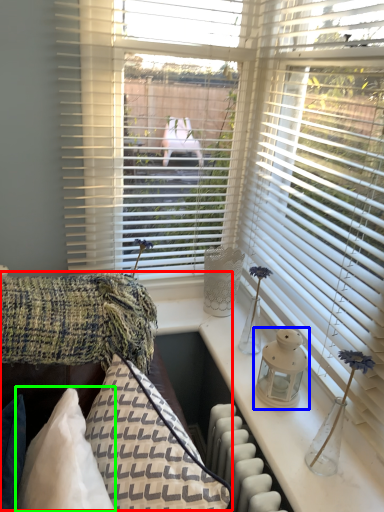
Question: Considering the real-world distances, which object is farthest from couch (highlighted by a red box)? candle holder (highlighted by a blue box) or pillow (highlighted by a green box)?

Choices:
 (A) candle holder
 (B) pillow

Answer: (A)